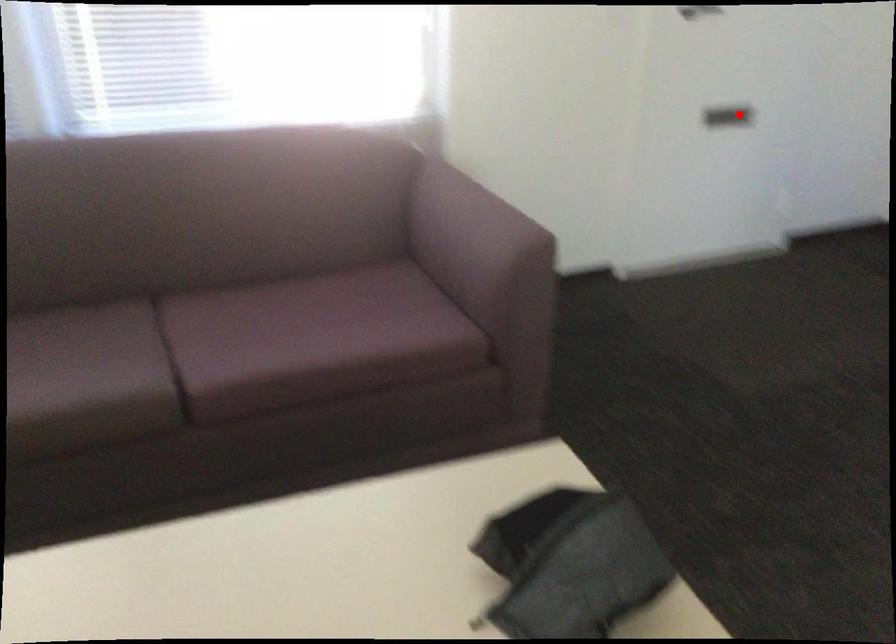
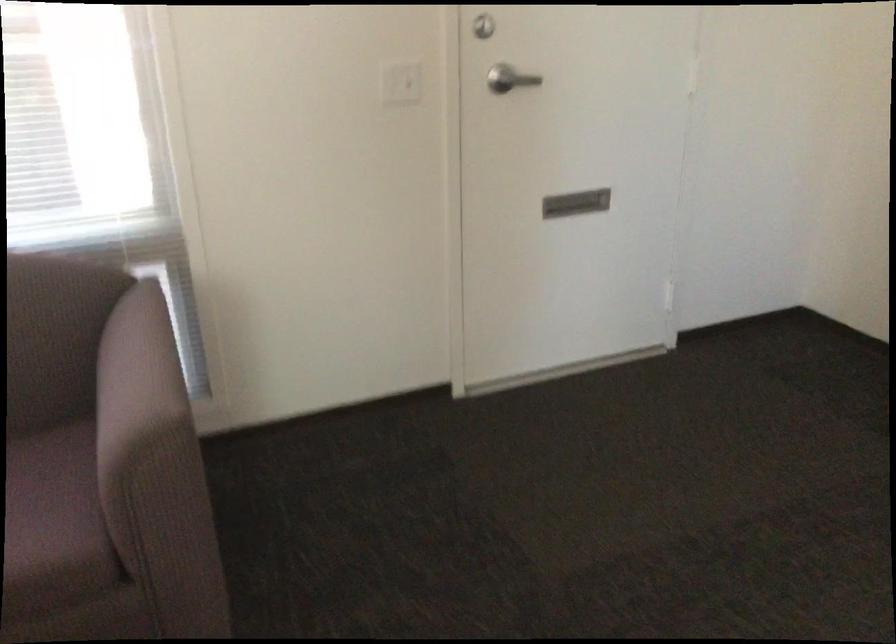
Find the pixel in the second image that matches the highlighted location in the first image.

(575, 203)